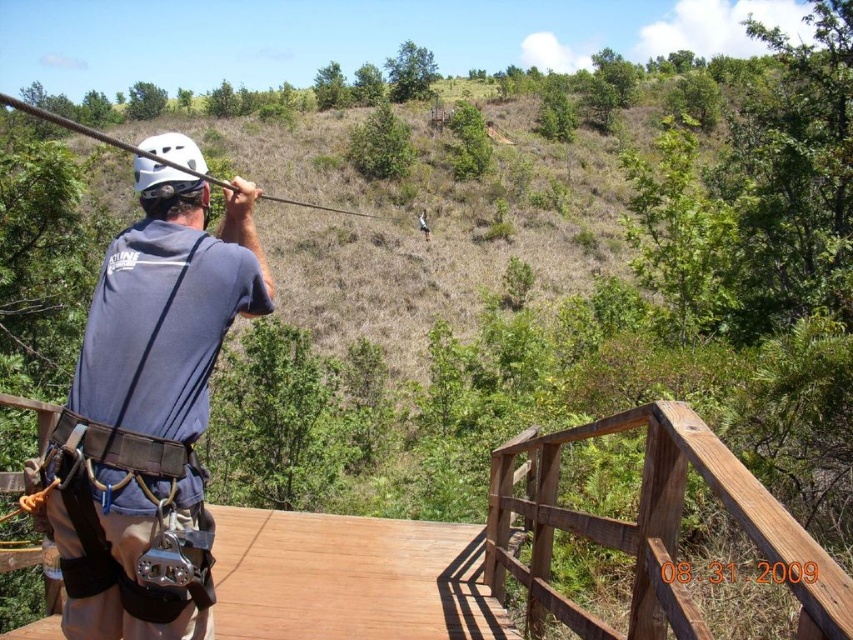
You are an outdoor guide assessing the scene. You notice the matte gray shirt at center and the brown wooden bridge at center. Which object takes up more visual space in the image?

The matte gray shirt at center has a larger size compared to the brown wooden bridge at center, so it takes up more visual space in the image.

You are a safety inspector checking the setup for a zip line activity. You notice the matte gray shirt at center and the white matte helmet at upper left. According to safety regulations, the distance between these two items must be at least 35 inches to ensure proper harness adjustment. Is the current distance compliant with the safety standards?

The matte gray shirt at center is 34.71 inches away from the white matte helmet at upper left, which is less than the required 35 inches. Therefore, the current distance does not comply with the safety standards.